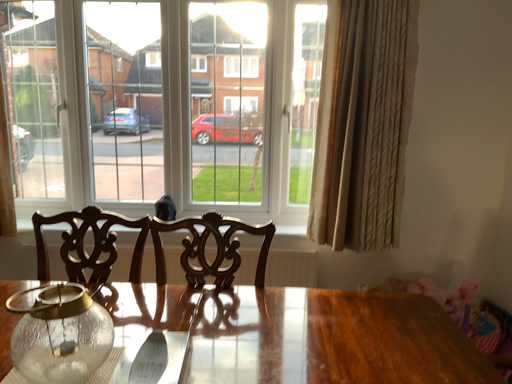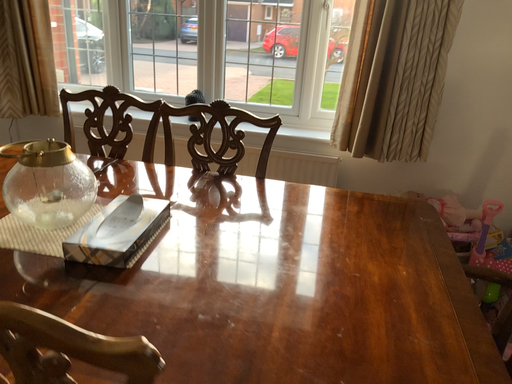
Question: Which way did the camera rotate in the video?

Choices:
 (A) rotated upward
 (B) rotated downward

Answer: (B)